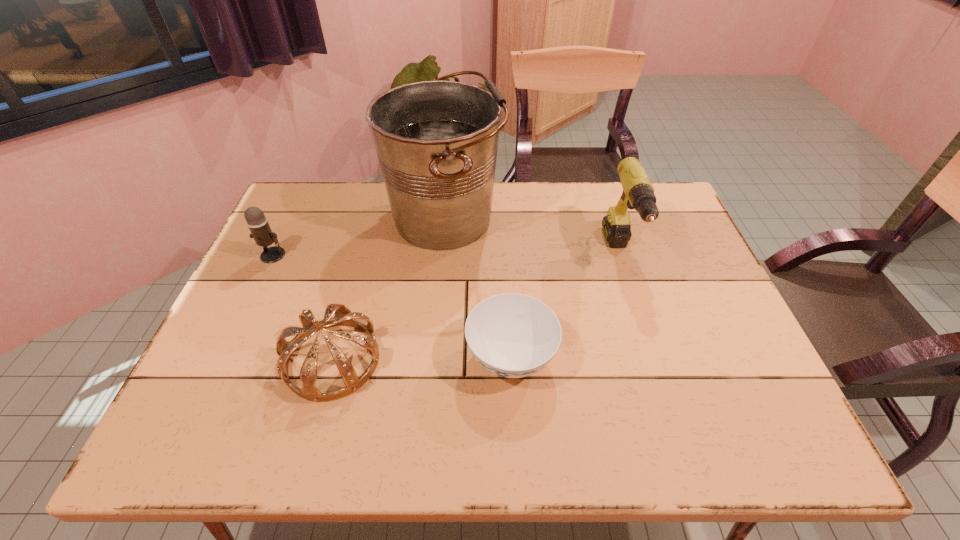
This screenshot has height=540, width=960. I want to click on vacant region that satisfies the following two spatial constraints: 1. on the back side of the bucket; 2. on the right side of the second shortest object, so click(x=372, y=218).

You are a GUI agent. You are given a task and a screenshot of the screen. Output one action in this format:
    pyautogui.click(x=<x>, y=<y>)
    Task: Click on the vacant space that satisfies the following two spatial constraints: 1. on the back side of the fourth tallest object; 2. on the right side of the tallest object
    This screenshot has width=960, height=540.
    Given the screenshot: What is the action you would take?
    pyautogui.click(x=372, y=218)